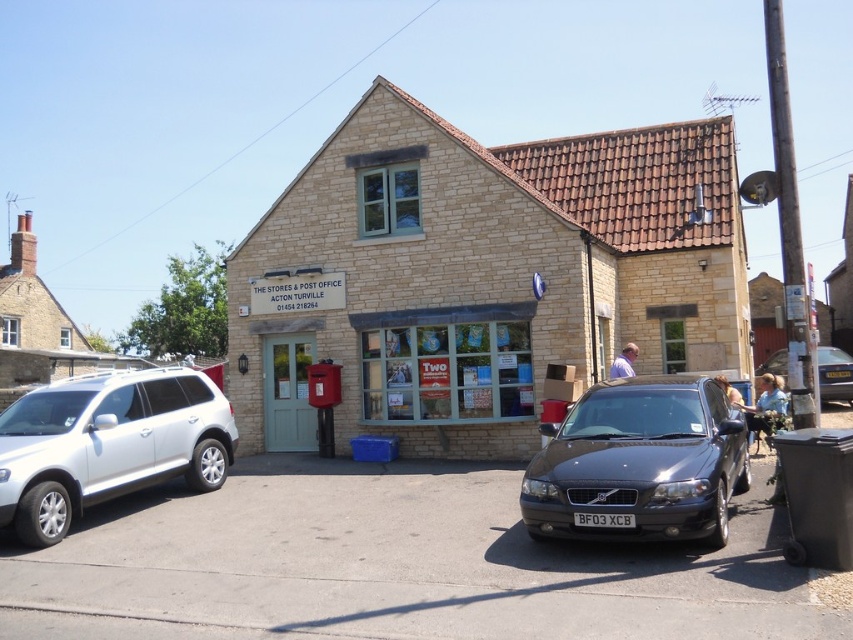
Is beige stone building at center bigger than metallic dark gray car at center?

Indeed, beige stone building at center has a larger size compared to metallic dark gray car at center.

Find the location of a particular element. The height and width of the screenshot is (640, 853). beige stone building at center is located at coordinates (480, 275).

Between metallic dark gray car at center and metallic gray sedan at center, which one is positioned lower?

Positioned lower is metallic dark gray car at center.

Locate an element on the screen. metallic dark gray car at center is located at coordinates (639, 464).

Which is behind, point (564, 486) or point (817, 364)?

The point (817, 364) is behind.

The image size is (853, 640). I want to click on metallic dark gray car at center, so click(x=639, y=464).

Is beige stone building at center closer to the viewer compared to metallic gray sedan at center?

No, it is not.

Is beige stone building at center shorter than metallic gray sedan at center?

No, beige stone building at center is not shorter than metallic gray sedan at center.

Which is in front, point (468, 413) or point (836, 397)?

Point (468, 413) is more forward.

Find the location of a particular element. Image resolution: width=853 pixels, height=640 pixels. beige stone building at center is located at coordinates (480, 275).